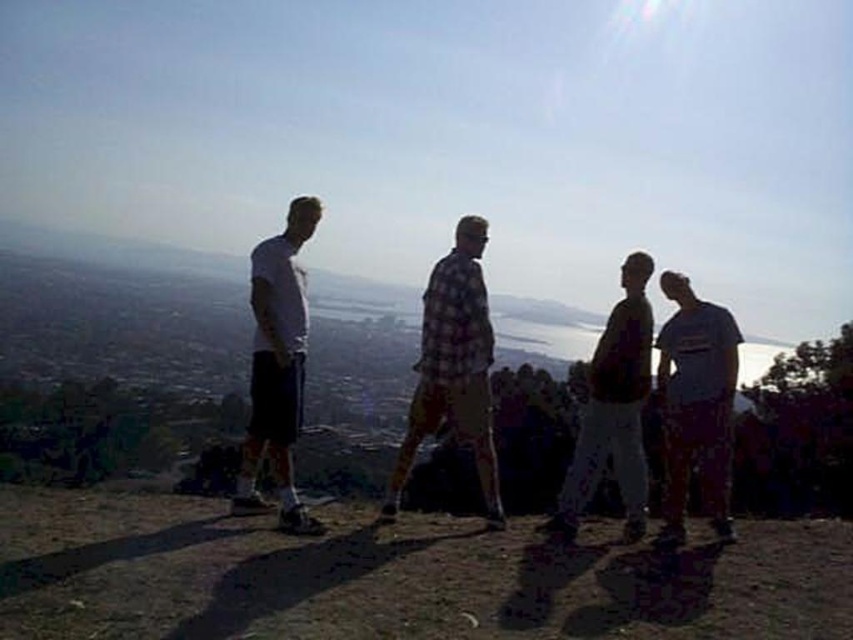
Does point (422, 412) come farther from viewer compared to point (260, 362)?

Yes, it is behind point (260, 362).

Who is higher up, checkered fabric shirt at center or white matte t-shirt at left?

Positioned higher is checkered fabric shirt at center.

Find the location of a particular element. This screenshot has width=853, height=640. checkered fabric shirt at center is located at coordinates (453, 368).

Can you confirm if gray cotton t-shirt at right is taller than dark brown leather jacket at center?

Yes, gray cotton t-shirt at right is taller than dark brown leather jacket at center.

Is point (694, 381) positioned after point (572, 472)?

No, (694, 381) is in front of (572, 472).

You are a GUI agent. You are given a task and a screenshot of the screen. Output one action in this format:
    pyautogui.click(x=<x>, y=<y>)
    Task: Click on the gray cotton t-shirt at right
    This screenshot has height=640, width=853.
    Given the screenshot: What is the action you would take?
    pyautogui.click(x=695, y=404)

Which is behind, point (669, 348) or point (254, 332)?

Point (254, 332)

Can you confirm if gray cotton t-shirt at right is taller than white matte t-shirt at left?

Yes, gray cotton t-shirt at right is taller than white matte t-shirt at left.

Is point (674, 280) farther from viewer compared to point (244, 480)?

Yes, point (674, 280) is behind point (244, 480).

The image size is (853, 640). In order to click on gray cotton t-shirt at right in this screenshot , I will do (695, 404).